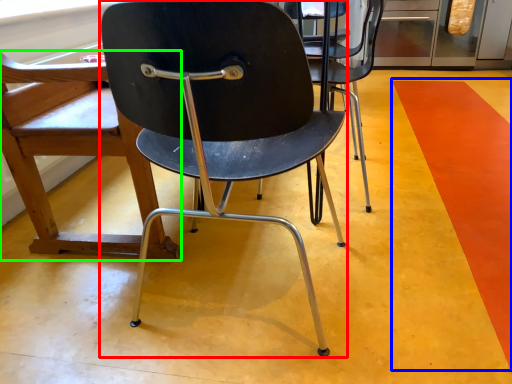
Question: Which is nearer to the chair (highlighted by a red box)? strip (highlighted by a blue box) or chair (highlighted by a green box).

Choices:
 (A) strip
 (B) chair

Answer: (B)